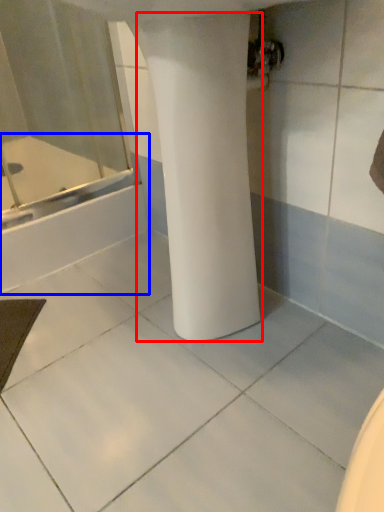
Question: Which of the following is the farthest to the observer, pillar (highlighted by a red box) or bathtub (highlighted by a blue box)?

Choices:
 (A) pillar
 (B) bathtub

Answer: (B)